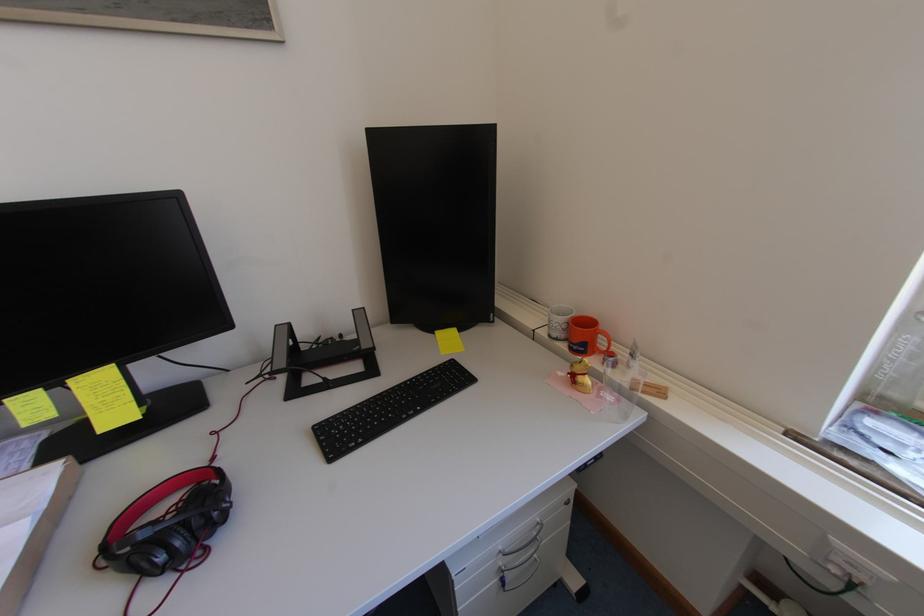
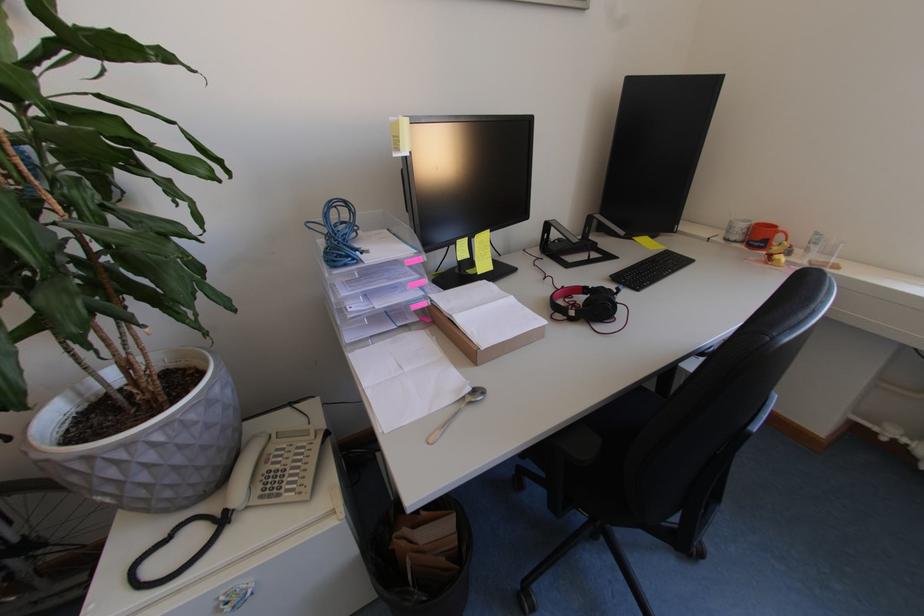
The point at (637, 368) is marked in the first image. Where is the corresponding point in the second image?

(816, 253)